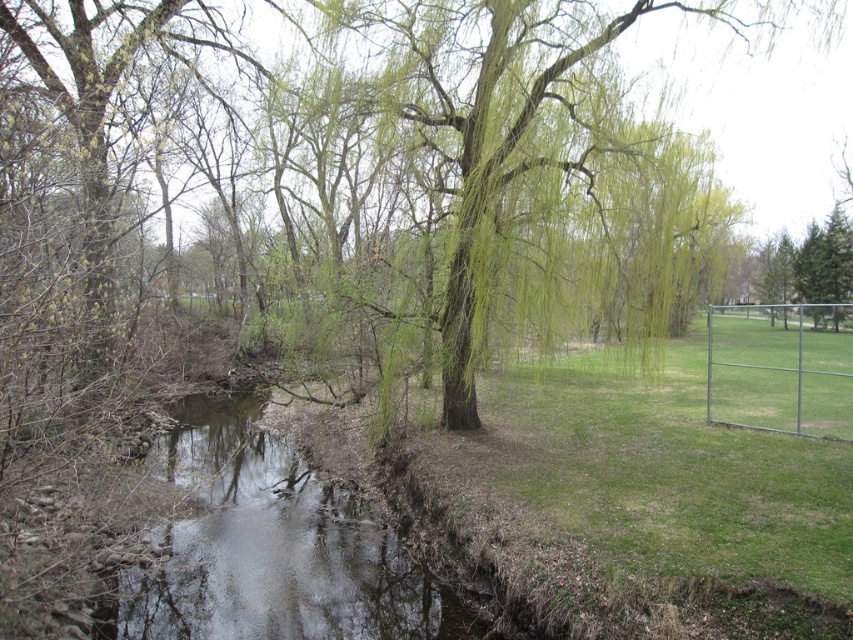
Question: Can you confirm if clear water at center is bigger than green leafy willow at center?

Choices:
 (A) yes
 (B) no

Answer: (B)

Question: Which point is closer to the camera?

Choices:
 (A) clear water at center
 (B) green leafy willow at center

Answer: (A)

Question: Which object is positioned farthest from the clear water at center?

Choices:
 (A) green leafy willow at center
 (B) metallic silver fence at right

Answer: (B)

Question: Considering the relative positions of clear water at center and green leafy willow at center in the image provided, where is clear water at center located with respect to green leafy willow at center?

Choices:
 (A) above
 (B) below

Answer: (B)

Question: Which point appears farthest from the camera in this image?

Choices:
 (A) (807, 332)
 (B) (219, 408)

Answer: (A)

Question: Does clear water at center have a larger size compared to metallic silver fence at right?

Choices:
 (A) no
 (B) yes

Answer: (A)